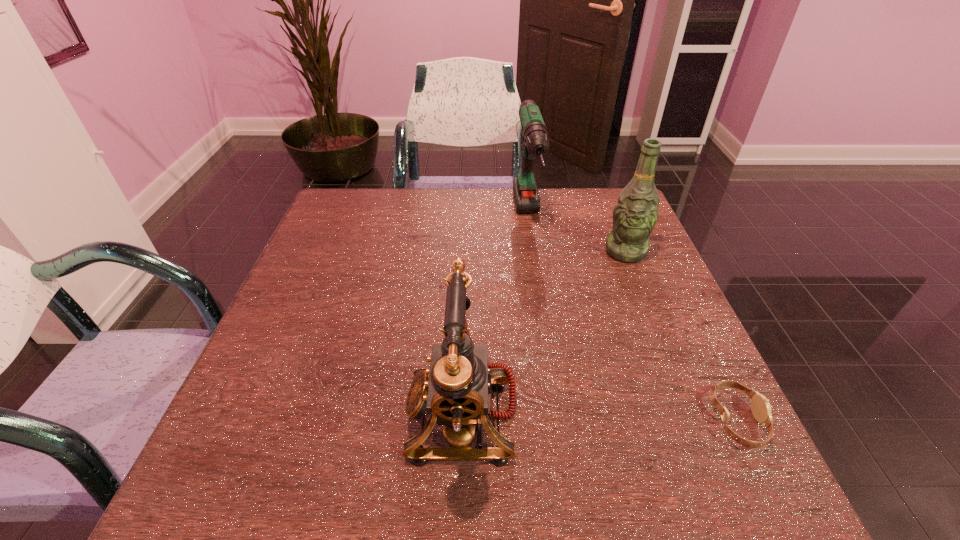
Where is `the leftmost object`? This screenshot has height=540, width=960. the leftmost object is located at coordinates (456, 390).

The image size is (960, 540). I want to click on watch, so click(x=760, y=406).

Locate an element on the screen. beer bottle is located at coordinates (635, 214).

The image size is (960, 540). What are the coordinates of `the third object from right to left` in the screenshot? It's located at (535, 135).

Locate an element on the screen. free spot located on the front of the leftmost object, featuring the rotary dial is located at coordinates (247, 415).

Image resolution: width=960 pixels, height=540 pixels. What are the coordinates of `vacant space located 0.200m on the front of the leftmost object, featuring the rotary dial` in the screenshot? It's located at (297, 415).

Locate an element on the screen. This screenshot has width=960, height=540. vacant space located on the front of the leftmost object, featuring the rotary dial is located at coordinates (364, 415).

Identify the location of vacant space located 0.050m on the surface of the beer bottle. This screenshot has width=960, height=540. (620, 276).

Locate an element on the screen. This screenshot has width=960, height=540. vacant position located 0.350m on the surface of the beer bottle is located at coordinates (601, 370).

The width and height of the screenshot is (960, 540). In order to click on vacant region located on the surface of the beer bottle in this screenshot , I will do `click(615, 298)`.